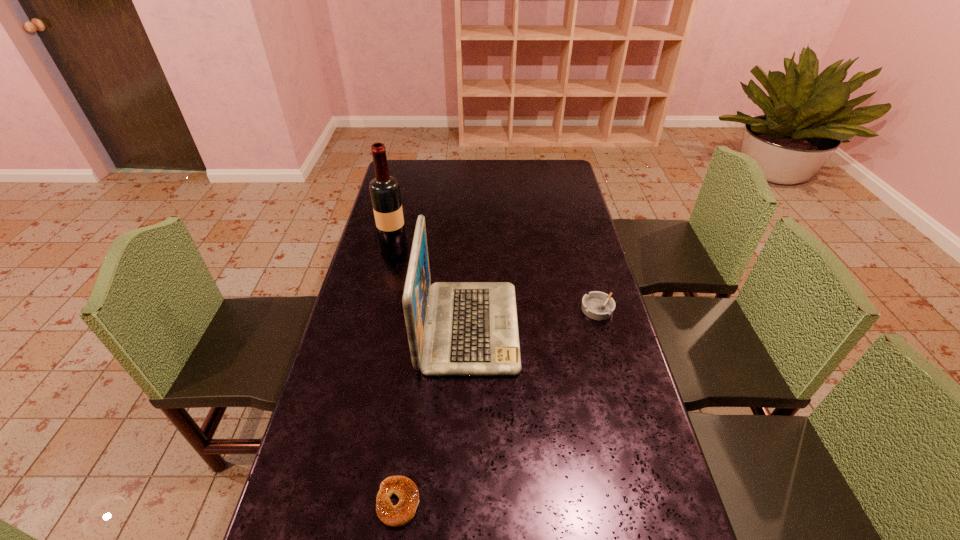
At what (x,y) coordinates should I click in order to perform the action: click on object that is positioned at the right edge. Please return your answer as a coordinate pair (x, y). Image resolution: width=960 pixels, height=540 pixels. Looking at the image, I should click on (597, 305).

In the image, there is a desktop. Where is `blank space at the far edge`? blank space at the far edge is located at coordinates (435, 174).

Find the location of a particular element. The width and height of the screenshot is (960, 540). free space at the left edge of the desktop is located at coordinates (413, 228).

The height and width of the screenshot is (540, 960). What are the coordinates of `vacant region at the right edge` in the screenshot? It's located at (573, 364).

The width and height of the screenshot is (960, 540). In the image, there is a desktop. Identify the location of blank space at the far right corner. (568, 172).

Where is `free point between the nearest object and the laptop computer`? The height and width of the screenshot is (540, 960). free point between the nearest object and the laptop computer is located at coordinates (434, 415).

Where is `unoccupied position between the tallest object and the nearest object`? unoccupied position between the tallest object and the nearest object is located at coordinates (396, 375).

Image resolution: width=960 pixels, height=540 pixels. In order to click on free area in between the third shortest object and the ashtray in this screenshot , I will do `click(533, 318)`.

Identify the location of vacant area that lies between the nearest object and the rightmost object. (498, 406).

This screenshot has height=540, width=960. In order to click on vacant region between the rightmost object and the nearest object in this screenshot , I will do `click(498, 406)`.